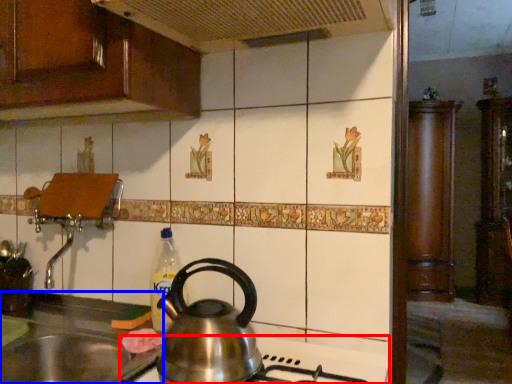
Question: Which object is closer to the camera taking this photo, gas stove (highlighted by a red box) or sink (highlighted by a blue box)?

Choices:
 (A) gas stove
 (B) sink

Answer: (A)